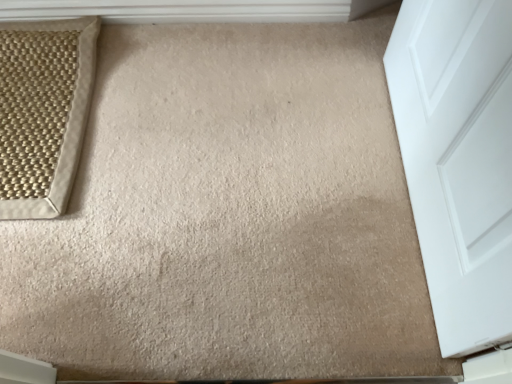
Locate an element on the screen. free point below beige woven rug at upper left (from a real-world perspective) is located at coordinates (35, 112).